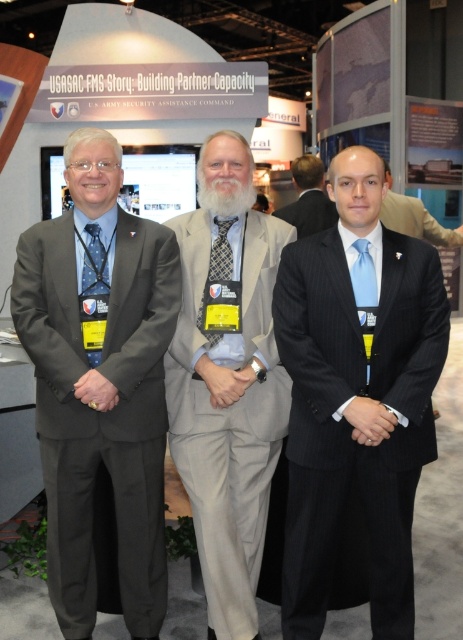
You are a photographer at the event and need to adjust the camera focus to capture both the matte gray suit at left and the blue dotted tie at left clearly. Given the camera has a depth of field that can cover objects within 40 centimeters of each other, will both items be in focus?

Result: The matte gray suit at left and blue dotted tie at left are 38.23 centimeters apart from each other. Since the distance between them is within the camera depth of field range of 40 centimeters, both items will be in focus.

You are organizing a photo shoot for a fashion magazine and need to arrange two models wearing the matte gray suit at left and the pinstripe suit at center. The photo requires the thinner suit to be placed on the right side for better visual balance. Can you position them correctly based on their current arrangement?

The matte gray suit at left is thinner than the pinstripe suit at center. To place the thinner suit on the right side, the matte gray suit at left should move to the right position, while the pinstripe suit at center moves to the left. This way, the thinner matte gray suit at left will be on the right as required.

You are a photographer at the event and need to arrange the two men wearing the matte gray suit at left and the blue dotted tie at left for a group photo. Which one should stand to the left to maintain their original positions?

The blue dotted tie at left should stand to the left because the matte gray suit at left is positioned on the right side of the blue dotted tie at left, so moving the blue dotted tie at left to the left maintains their original relative positions.